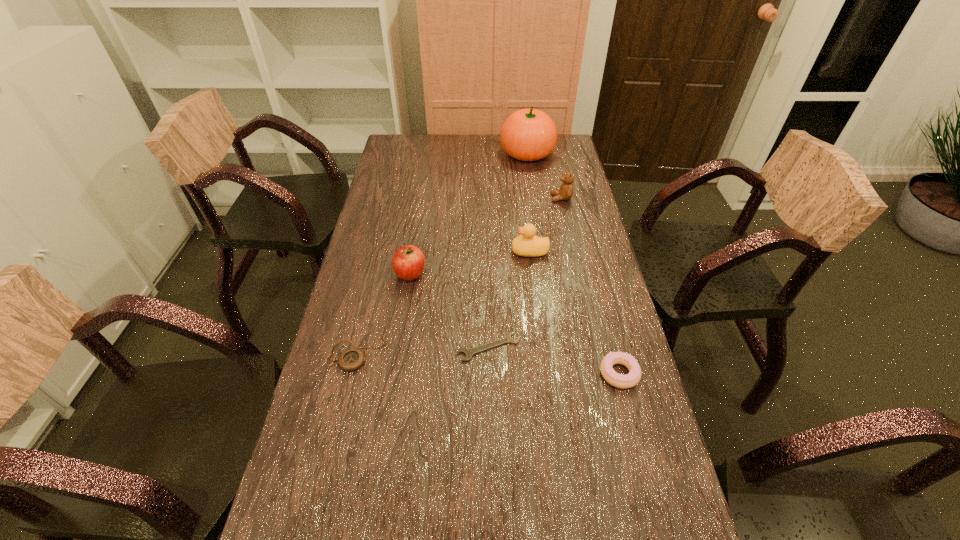
Locate an element on the screen. apple located at the left edge is located at coordinates (408, 262).

Where is `pocket watch at the left edge`? Image resolution: width=960 pixels, height=540 pixels. pocket watch at the left edge is located at coordinates pyautogui.click(x=351, y=359).

Identify the location of pumpkin situated at the right edge. Image resolution: width=960 pixels, height=540 pixels. (529, 134).

Locate an element on the screen. The width and height of the screenshot is (960, 540). teddy bear at the right edge is located at coordinates (566, 189).

Where is `doughnut present at the right edge`? doughnut present at the right edge is located at coordinates (617, 380).

This screenshot has width=960, height=540. I want to click on object situated at the far right corner, so click(529, 134).

Locate an element on the screen. The height and width of the screenshot is (540, 960). vacant space at the far edge of the desktop is located at coordinates (435, 152).

Identify the location of vacant position at the left edge of the desktop. (364, 344).

Locate an element on the screen. vacant space at the right edge is located at coordinates (606, 389).

The height and width of the screenshot is (540, 960). I want to click on vacant region at the far right corner of the desktop, so click(x=570, y=148).